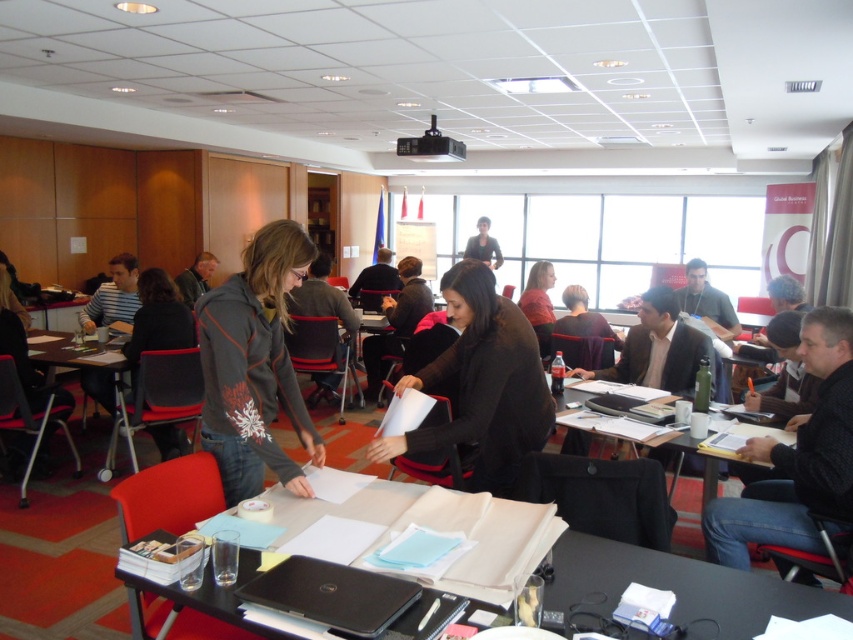
You are a guest in the conference room and need to sit down at the black plastic table at center. Where should you sit to avoid the black matte jacket at center?

You should sit on the right side of the black plastic table at center since the black matte jacket at center is on the left side of the table.

You are a photographer setting up for a group photo in the conference room. You need to position a tall tripod between the dark gray hoodie at center and the wooden table at left. Considering their heights, which object will the tripod need to be placed closer to in order to avoid blocking the view of the shorter one?

The dark gray hoodie at center is much taller than the wooden table at left. To avoid blocking the view of the shorter wooden table at left, the tripod should be placed closer to the dark gray hoodie at center.

You are standing in the conference room and see two points marked on the floor. The first is at point (207, 324) and the second is at point (91, 368). If you are facing the direction of the table where the two people are working, which point is closer to you?

Point (91, 368) is closer to you because it is behind point (207, 324), which means when facing the table, the point (91, 368) would be nearer to your current position.